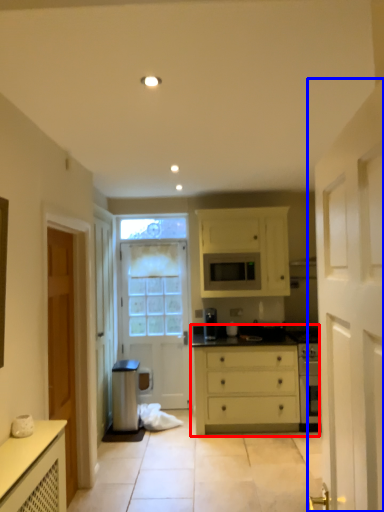
Question: Which of the following is the closest to the observer, chest of drawers (highlighted by a red box) or door (highlighted by a blue box)?

Choices:
 (A) chest of drawers
 (B) door

Answer: (B)